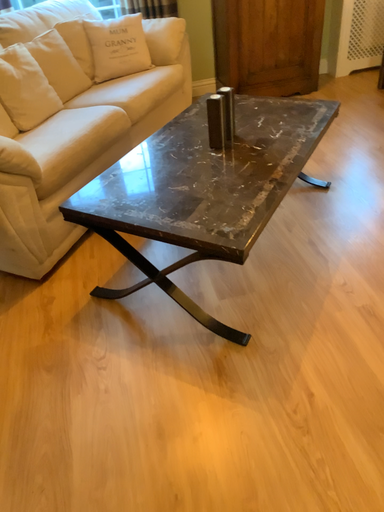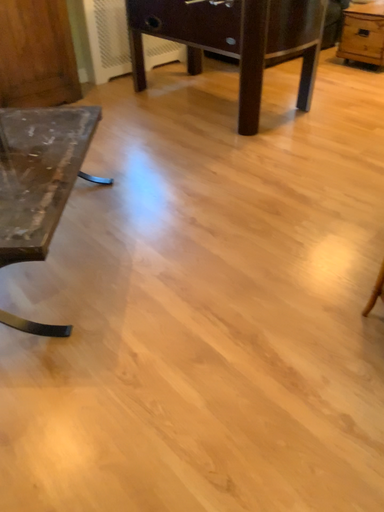
Question: Which way did the camera rotate in the video?

Choices:
 (A) rotated right
 (B) rotated left

Answer: (A)